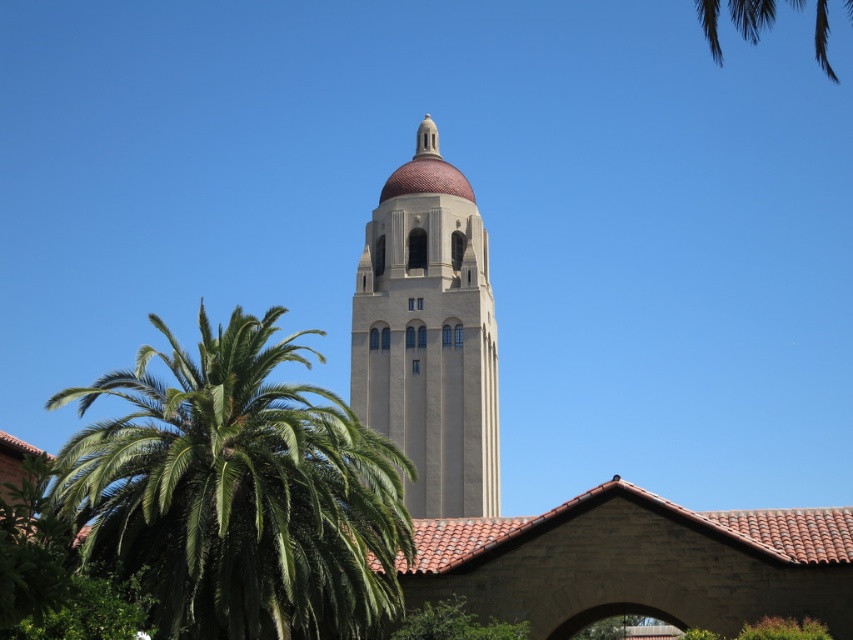
In the scene shown: Can you confirm if green leafy palm at left is positioned to the right of beige stone bell tower at center?

Incorrect, green leafy palm at left is not on the right side of beige stone bell tower at center.

Identify the location of green leafy palm at left. This screenshot has width=853, height=640. (238, 492).

Who is lower down, beige stone bell tower at center or green leafy palm tree at upper right?

beige stone bell tower at center

Is point (428, 292) closer to viewer compared to point (766, 1)?

No, (428, 292) is further to viewer.

Find the location of a particular element. The width and height of the screenshot is (853, 640). beige stone bell tower at center is located at coordinates (428, 333).

Who is shorter, beige stone bell tower at center or green leafy tree at lower center?

green leafy tree at lower center is shorter.

Is beige stone bell tower at center shorter than green leafy tree at lower center?

In fact, beige stone bell tower at center may be taller than green leafy tree at lower center.

Who is more forward, (x=387, y=381) or (x=526, y=628)?

Point (x=526, y=628) is more forward.

The height and width of the screenshot is (640, 853). I want to click on beige stone bell tower at center, so click(x=428, y=333).